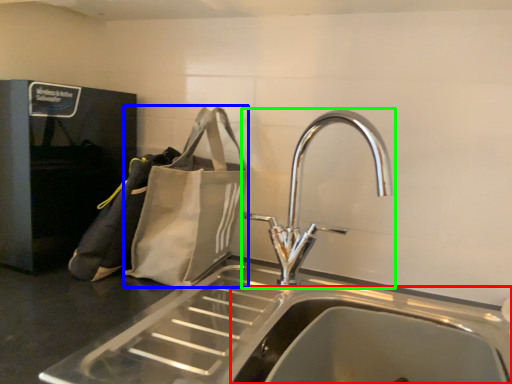
Question: Considering the real-world distances, which object is closest to sink (highlighted by a red box)? pouch (highlighted by a blue box) or tap (highlighted by a green box).

Choices:
 (A) pouch
 (B) tap

Answer: (B)